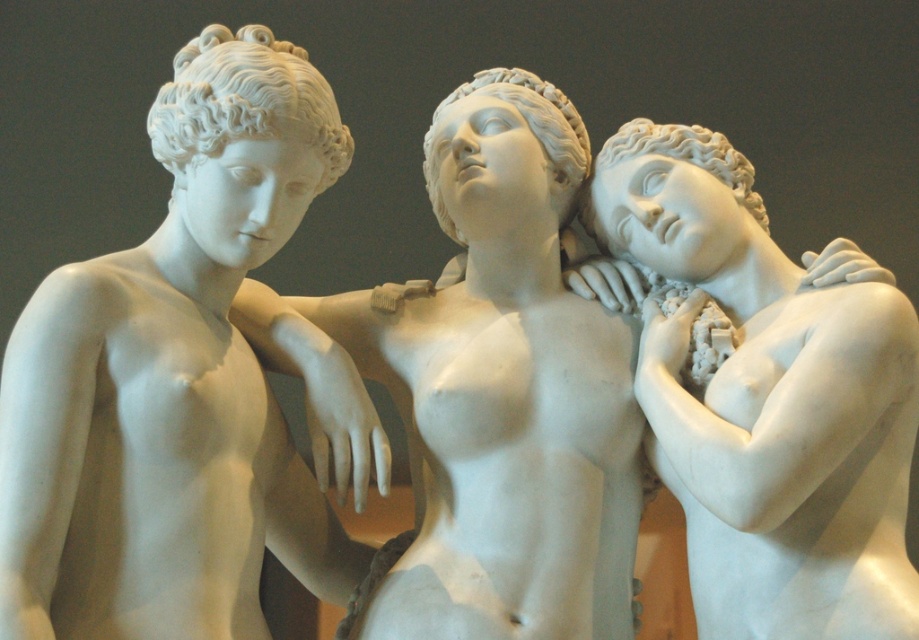
Question: Is white marble statue at center smaller than white marble statue at right?

Choices:
 (A) yes
 (B) no

Answer: (B)

Question: Considering the relative positions of white marble statue at left and white marble statue at center in the image provided, where is white marble statue at left located with respect to white marble statue at center?

Choices:
 (A) left
 (B) right

Answer: (A)

Question: Does white marble statue at left have a greater width compared to white marble statue at right?

Choices:
 (A) yes
 (B) no

Answer: (A)

Question: Which point is closer to the camera?

Choices:
 (A) white marble statue at right
 (B) white marble statue at center
 (C) white marble statue at left

Answer: (C)

Question: Which point is closer to the camera?

Choices:
 (A) click(x=630, y=525)
 (B) click(x=258, y=179)

Answer: (B)

Question: Which point is closer to the camera?

Choices:
 (A) white marble statue at left
 (B) white marble statue at center
 (C) white marble statue at right

Answer: (A)